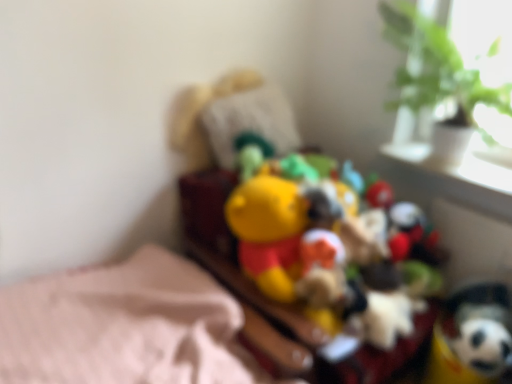
Question: Is green leafy plant at upper right wider than yellow plush toy at center, arranged as the 2th toy when viewed from the right?

Choices:
 (A) yes
 (B) no

Answer: (B)

Question: Is green leafy plant at upper right shorter than yellow plush toy at center, which ranks as the 1th toy in left-to-right order?

Choices:
 (A) yes
 (B) no

Answer: (A)

Question: Does green leafy plant at upper right have a larger size compared to yellow plush toy at center, arranged as the 2th toy when viewed from the right?

Choices:
 (A) yes
 (B) no

Answer: (B)

Question: Is green leafy plant at upper right to the right of yellow plush toy at center, arranged as the 2th toy when viewed from the right, from the viewer's perspective?

Choices:
 (A) yes
 (B) no

Answer: (A)

Question: From a real-world perspective, is green leafy plant at upper right physically above yellow plush toy at center, which ranks as the 1th toy in left-to-right order?

Choices:
 (A) no
 (B) yes

Answer: (B)

Question: In terms of size, does white glossy window sill at upper right appear bigger or smaller than yellow plush toy at center, which ranks as the 1th toy in left-to-right order?

Choices:
 (A) big
 (B) small

Answer: (B)

Question: Relative to yellow plush toy at center, which ranks as the 1th toy in left-to-right order, is white glossy window sill at upper right in front or behind?

Choices:
 (A) front
 (B) behind

Answer: (B)

Question: From a real-world perspective, is white glossy window sill at upper right positioned above or below yellow plush toy at center, which ranks as the 1th toy in left-to-right order?

Choices:
 (A) below
 (B) above

Answer: (B)

Question: Considering the positions of white glossy window sill at upper right and yellow plush toy at center, which ranks as the 1th toy in left-to-right order, in the image, is white glossy window sill at upper right wider or thinner than yellow plush toy at center, which ranks as the 1th toy in left-to-right order,?

Choices:
 (A) thin
 (B) wide

Answer: (A)

Question: From the image's perspective, is yellow plush toy at center, arranged as the 2th toy when viewed from the right, above or below white glossy window sill at upper right?

Choices:
 (A) below
 (B) above

Answer: (A)

Question: Looking at their shapes, would you say yellow plush toy at center, which ranks as the 1th toy in left-to-right order, is wider or thinner than white glossy window sill at upper right?

Choices:
 (A) wide
 (B) thin

Answer: (A)

Question: Considering the relative positions of yellow plush toy at center, which ranks as the 1th toy in left-to-right order, and white glossy window sill at upper right in the image provided, is yellow plush toy at center, which ranks as the 1th toy in left-to-right order, to the left or to the right of white glossy window sill at upper right?

Choices:
 (A) right
 (B) left

Answer: (B)

Question: From their relative heights in the image, would you say yellow plush toy at center, arranged as the 2th toy when viewed from the right, is taller or shorter than white glossy window sill at upper right?

Choices:
 (A) tall
 (B) short

Answer: (A)

Question: Considering the positions of yellow plush toy at center, arranged as the 2th toy when viewed from the right, and soft plush toy at lower right, the second toy when ordered from left to right, in the image, is yellow plush toy at center, arranged as the 2th toy when viewed from the right, bigger or smaller than soft plush toy at lower right, the second toy when ordered from left to right,?

Choices:
 (A) small
 (B) big

Answer: (B)

Question: From a real-world perspective, is yellow plush toy at center, arranged as the 2th toy when viewed from the right, positioned above or below soft plush toy at lower right, the second toy when ordered from left to right?

Choices:
 (A) below
 (B) above

Answer: (B)